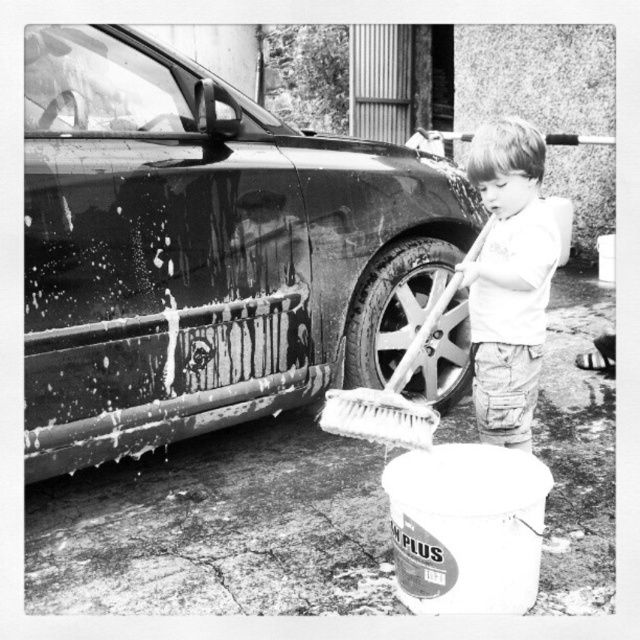
Question: Which point appears farthest from the camera in this image?

Choices:
 (A) (88, 364)
 (B) (376, 310)
 (C) (387, 408)

Answer: (B)

Question: Which is farther from the white bristle brush at lower center?

Choices:
 (A) smooth white shirt at center
 (B) metallic silver wheel at lower center
 (C) shiny black car at left

Answer: (B)

Question: Is smooth white shirt at center below white bristle brush at lower center?

Choices:
 (A) no
 (B) yes

Answer: (A)

Question: Can you confirm if metallic silver wheel at lower center is smaller than white bristle brush at lower center?

Choices:
 (A) yes
 (B) no

Answer: (B)

Question: Does smooth white shirt at center have a smaller size compared to metallic silver wheel at lower center?

Choices:
 (A) yes
 (B) no

Answer: (A)

Question: Based on their relative distances, which object is nearer to the metallic silver wheel at lower center?

Choices:
 (A) white bristle brush at lower center
 (B) smooth white shirt at center
 (C) shiny black car at left

Answer: (C)